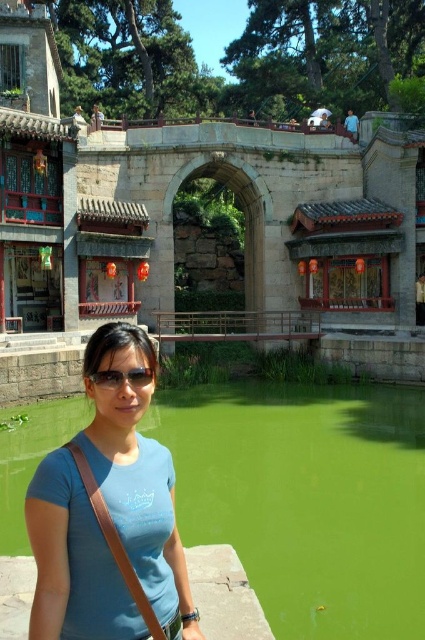
Is stone archway at center positioned in front of green algae water at lower center?

That is False.

How far apart are stone archway at center and green algae water at lower center?

stone archway at center and green algae water at lower center are 14.50 meters apart.

Does point (161, 292) come farther from viewer compared to point (345, 385)?

Yes, it is.

Locate an element on the screen. This screenshot has height=640, width=425. stone archway at center is located at coordinates (172, 224).

Who is taller, blue fabric shirt at lower left or black plastic goggles at center?

blue fabric shirt at lower left is taller.

In the scene shown: Does blue fabric shirt at lower left have a larger size compared to black plastic goggles at center?

Indeed, blue fabric shirt at lower left has a larger size compared to black plastic goggles at center.

You are a GUI agent. You are given a task and a screenshot of the screen. Output one action in this format:
    pyautogui.click(x=<x>, y=<y>)
    Task: Click on the blue fabric shirt at lower left
    
    Given the screenshot: What is the action you would take?
    pyautogui.click(x=108, y=516)

Between green algae water at lower center and black plastic goggles at center, which one is positioned lower?

green algae water at lower center

Does green algae water at lower center have a lesser height compared to black plastic goggles at center?

In fact, green algae water at lower center may be taller than black plastic goggles at center.

You are a GUI agent. You are given a task and a screenshot of the screen. Output one action in this format:
    pyautogui.click(x=<x>, y=<y>)
    Task: Click on the green algae water at lower center
    
    Given the screenshot: What is the action you would take?
    pyautogui.click(x=308, y=497)

Where is `green algae water at lower center`? The height and width of the screenshot is (640, 425). green algae water at lower center is located at coordinates (308, 497).